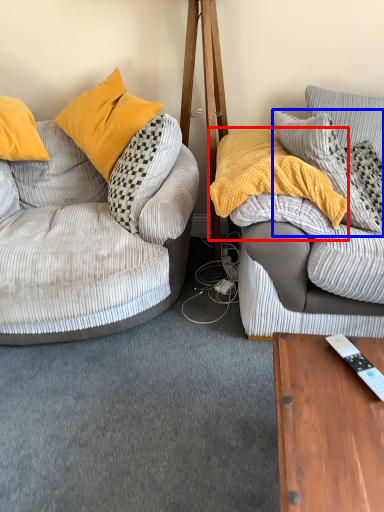
Question: Among these objects, which one is nearest to the camera, material (highlighted by a red box) or pillow (highlighted by a blue box)?

Choices:
 (A) material
 (B) pillow

Answer: (A)